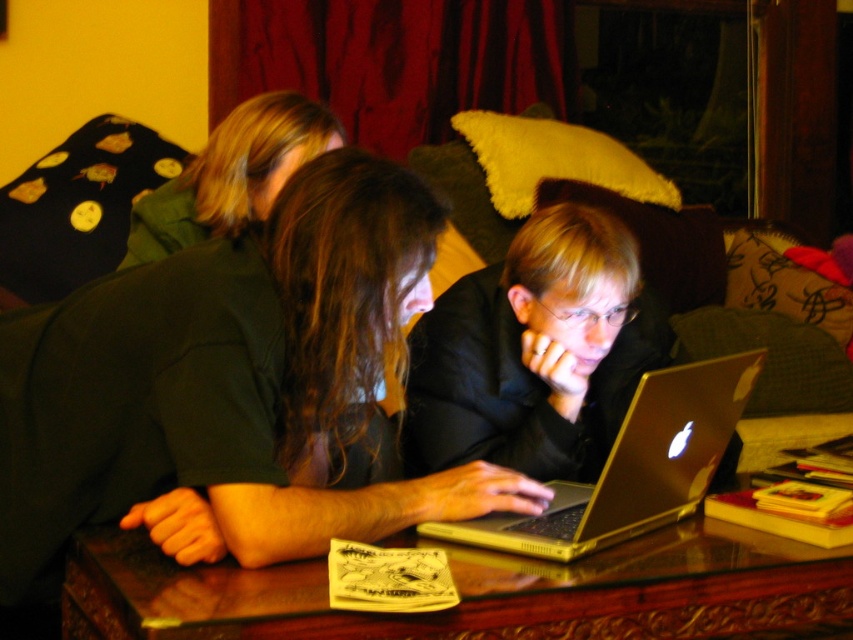
Who is positioned more to the right, matte black laptop at center or shiny black laptop at center?

From the viewer's perspective, shiny black laptop at center appears more on the right side.

Which is above, matte black laptop at center or shiny black laptop at center?

shiny black laptop at center is higher up.

Locate an element on the screen. The image size is (853, 640). matte black laptop at center is located at coordinates (231, 388).

Between point (751, 545) and point (248, 104), which one is positioned behind?

Point (248, 104)

Does point (671, 589) come closer to viewer compared to point (216, 195)?

Yes, point (671, 589) is closer to viewer.

Is point (119, 556) farther from viewer compared to point (276, 173)?

No, it is not.

Locate an element on the screen. wooden table at center is located at coordinates (469, 592).

Does wooden table at center have a lesser width compared to shiny black laptop at center?

In fact, wooden table at center might be wider than shiny black laptop at center.

Is point (190, 634) closer to camera compared to point (514, 273)?

That is True.

I want to click on wooden table at center, so click(x=469, y=592).